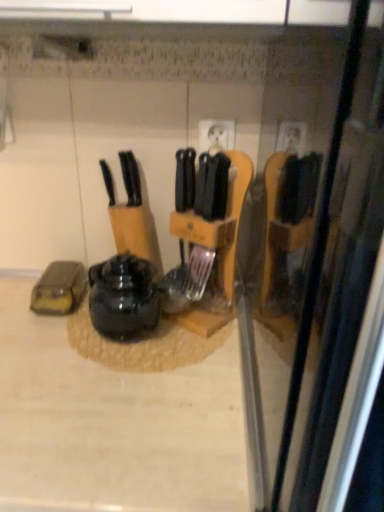
At what (x,y) coordinates should I click in order to perform the action: click on free space to the left of shiny black kettle at center. Please return your answer as a coordinate pair (x, y). Looking at the image, I should click on (40, 336).